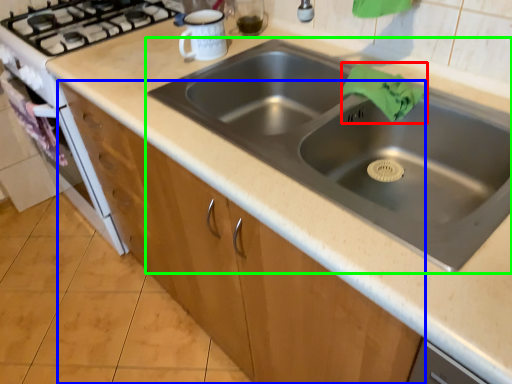
Question: Which is nearer to the cloth (highlighted by a red box)? cabinetry (highlighted by a blue box) or sink (highlighted by a green box).

Choices:
 (A) cabinetry
 (B) sink

Answer: (B)